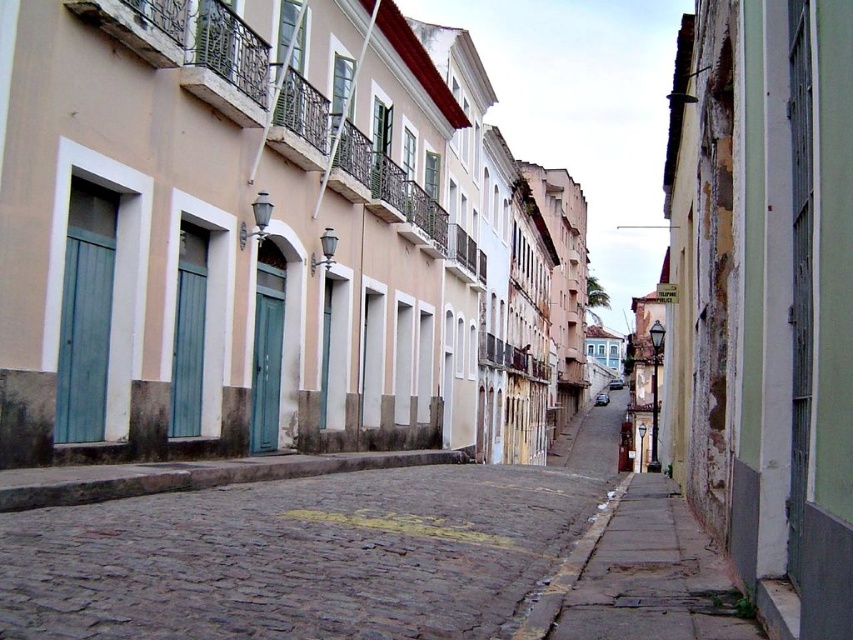
Question: Which of the following is the closest to the observer?

Choices:
 (A) smooth concrete sidewalk at lower right
 (B) brown cobblestone pavement at center

Answer: (B)

Question: Observing the image, what is the correct spatial positioning of brown cobblestone pavement at center in reference to smooth concrete sidewalk at lower right?

Choices:
 (A) below
 (B) above

Answer: (A)

Question: Which of the following is the closest to the observer?

Choices:
 (A) (717, 577)
 (B) (218, 545)

Answer: (B)

Question: Can you confirm if brown cobblestone pavement at center is positioned above smooth concrete sidewalk at lower right?

Choices:
 (A) no
 (B) yes

Answer: (A)

Question: Among these points, which one is nearest to the camera?

Choices:
 (A) (683, 563)
 (B) (10, 576)

Answer: (B)

Question: Is brown cobblestone pavement at center wider than smooth concrete sidewalk at lower right?

Choices:
 (A) yes
 (B) no

Answer: (A)